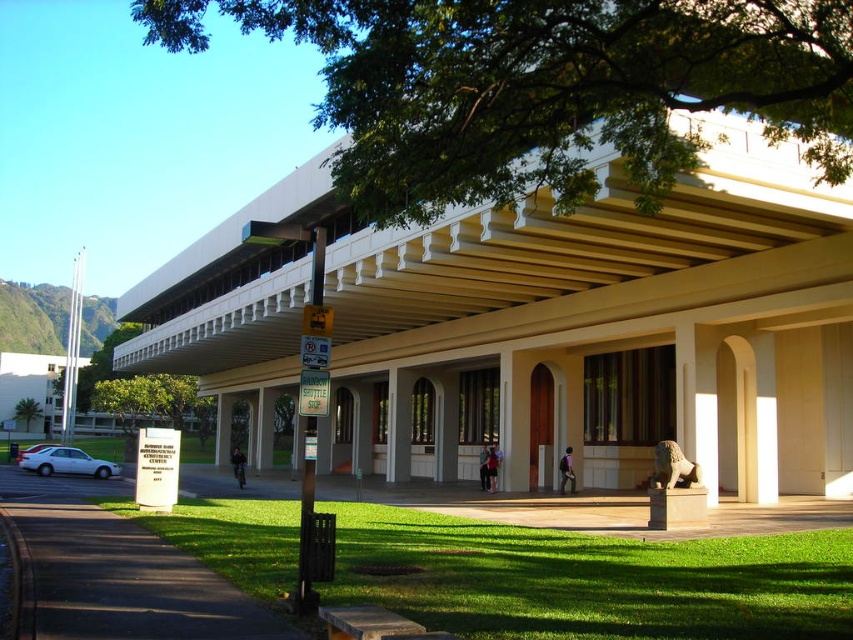
Question: Which object appears farthest from the camera in this image?

Choices:
 (A) white glossy sedan at lower left
 (B) white matte sedan at lower left
 (C) dark asphalt pavement at lower left

Answer: (A)

Question: Can you confirm if green leafy tree at upper center is wider than dark asphalt pavement at lower left?

Choices:
 (A) yes
 (B) no

Answer: (A)

Question: Observing the image, what is the correct spatial positioning of green leafy tree at upper center in reference to white matte sedan at lower left?

Choices:
 (A) below
 (B) above

Answer: (B)

Question: Which is nearer to the dark asphalt pavement at lower left?

Choices:
 (A) green leafy tree at lower left
 (B) green leafy tree at upper center

Answer: (B)

Question: Is green leafy tree at upper center bigger than white matte sedan at lower left?

Choices:
 (A) yes
 (B) no

Answer: (A)

Question: Which is farther from the green leafy tree at lower left?

Choices:
 (A) white glossy sedan at lower left
 (B) white matte sedan at lower left
 (C) dark asphalt pavement at lower left

Answer: (C)